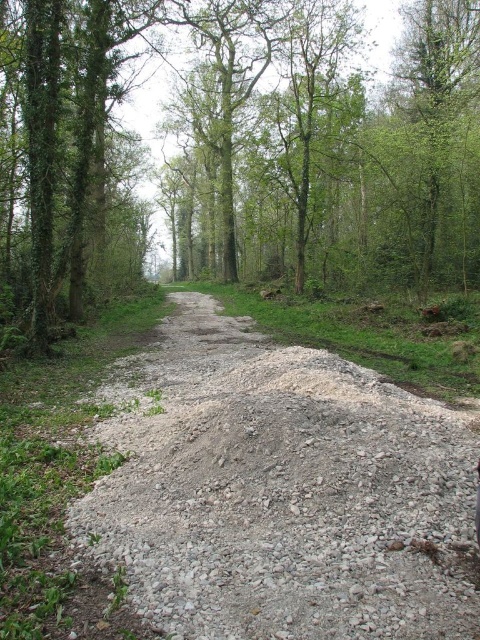
Which of these two, green leafy tree at center or gray gravel dirt track at center, stands taller?

green leafy tree at center

Is point (333, 264) positioned before point (264, 339)?

No, (333, 264) is behind (264, 339).

This screenshot has height=640, width=480. I want to click on green leafy tree at center, so click(240, 148).